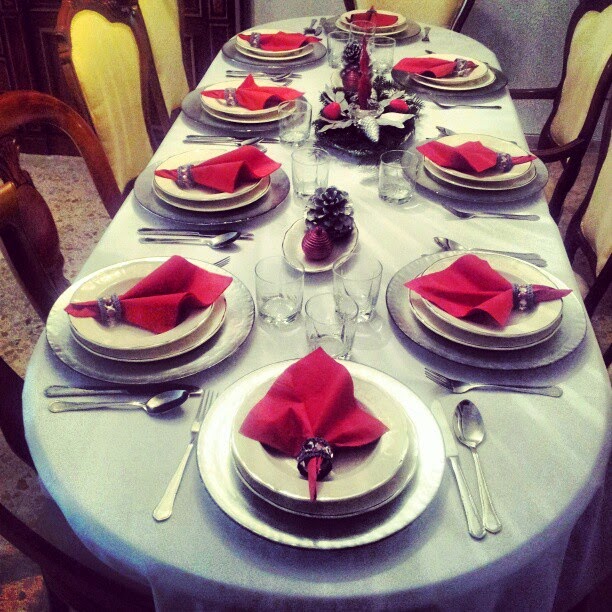
Where is `forks`? forks is located at coordinates (174, 480), (501, 386), (226, 259), (504, 210), (480, 102), (424, 31).